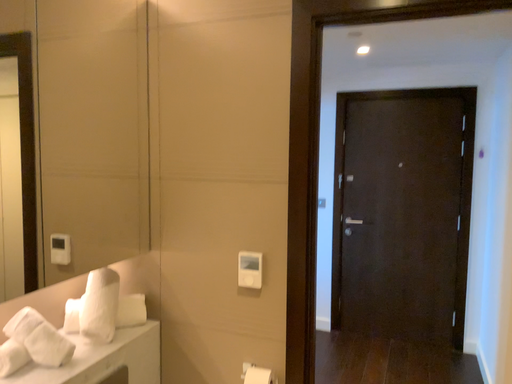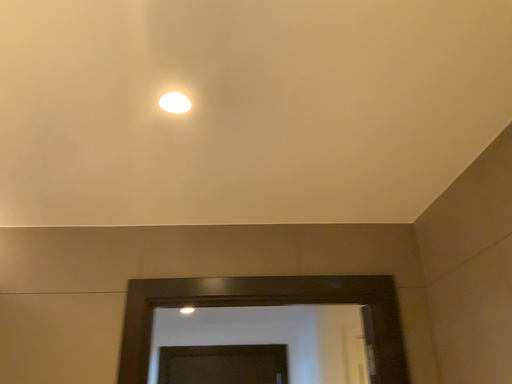
Question: Which way did the camera rotate in the video?

Choices:
 (A) rotated right
 (B) rotated left

Answer: (A)